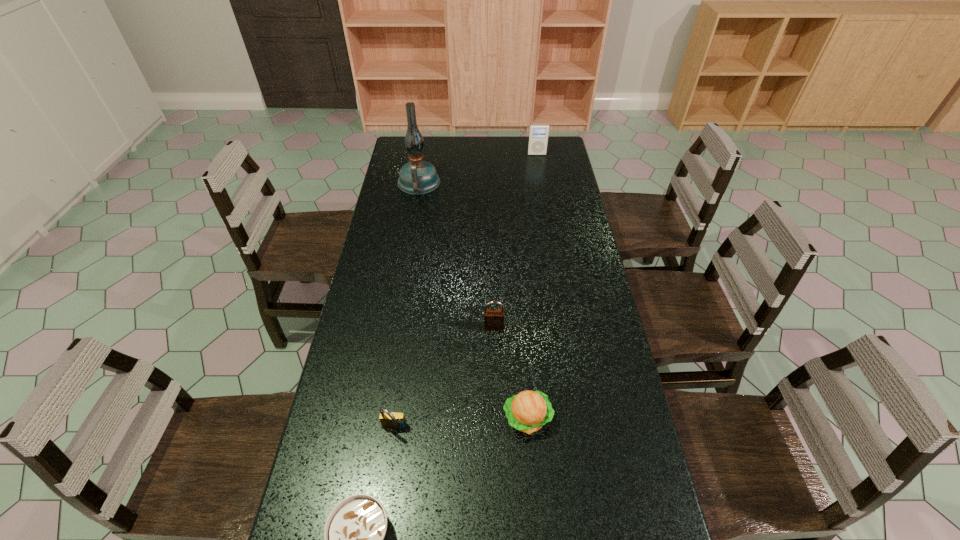
Locate which object is the fifth closest to the rightmost object. Please provide its 2D coordinates. Your answer should be formatted as a tuple, i.e. [(x, y)], where the tuple contains the x and y coordinates of a point satisfying the conditions above.

[(354, 531)]

Locate an element on the screen. The width and height of the screenshot is (960, 540). object that is the third closest to the right padlock is located at coordinates (354, 531).

What are the coordinates of `free space that satisfies the following two spatial constraints: 1. on the front-facing side of the third farthest object; 2. on the left side of the hamburger` in the screenshot? It's located at (496, 418).